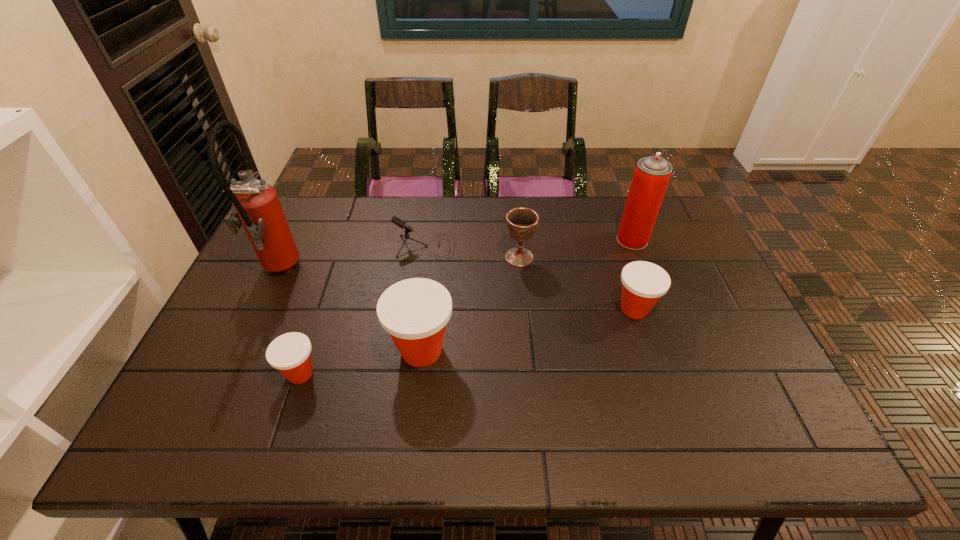
You are a GUI agent. You are given a task and a screenshot of the screen. Output one action in this format:
    pyautogui.click(x=<x>, y=<y>)
    Task: Click on the spot to insert another Dixie_cup for uniform distribution
    
    Given the screenshot: What is the action you would take?
    pyautogui.click(x=533, y=329)